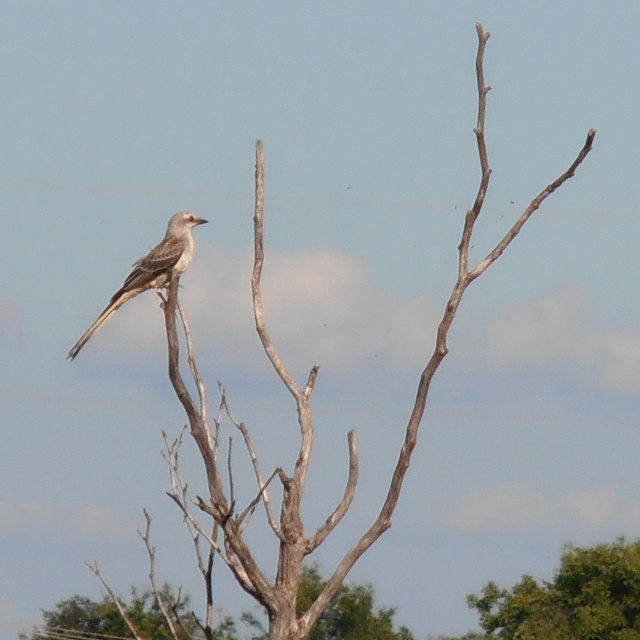
Question: Which point appears farthest from the camera in this image?

Choices:
 (A) click(x=188, y=216)
 (B) click(x=360, y=604)

Answer: (B)

Question: Which point appears closest to the camera in this image?

Choices:
 (A) coord(500,593)
 (B) coord(74,352)
 (C) coord(243,616)

Answer: (B)

Question: Can you confirm if green leafy tree at lower right is positioned above brown rough tree trunk at center?

Choices:
 (A) no
 (B) yes

Answer: (B)

Question: Can you confirm if green leafy tree at lower right is positioned to the right of grayish-brown feathered bird at center?

Choices:
 (A) no
 (B) yes

Answer: (B)

Question: Which is farther from the brown rough tree trunk at center?

Choices:
 (A) grayish-brown feathered bird at center
 (B) green leafy tree at lower right

Answer: (A)

Question: Does green leafy tree at lower right appear on the right side of grayish-brown feathered bird at center?

Choices:
 (A) no
 (B) yes

Answer: (B)